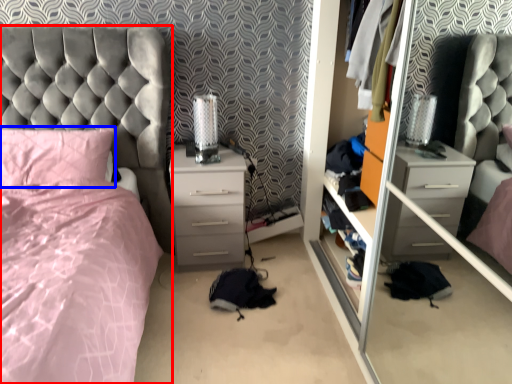
Question: Which of the following is the farthest to the observer, bed (highlighted by a red box) or pillow (highlighted by a blue box)?

Choices:
 (A) bed
 (B) pillow

Answer: (B)